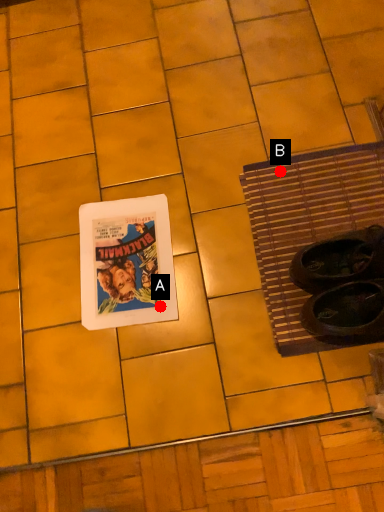
Question: Two points are circled on the image, labeled by A and B beside each circle. Which point is farther from the camera taking this photo?

Choices:
 (A) A is further
 (B) B is further

Answer: (B)